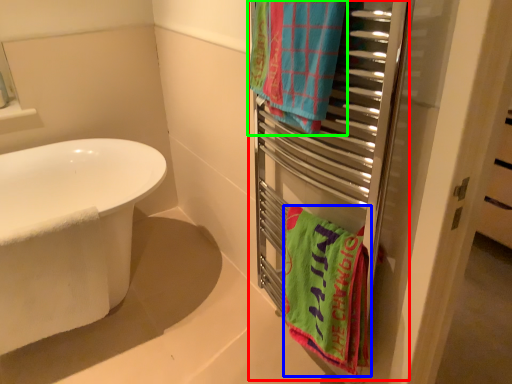
Question: Which is nearer to the closet (highlighted by a red box)? towel/napkin (highlighted by a blue box) or towel/napkin (highlighted by a green box).

Choices:
 (A) towel/napkin
 (B) towel/napkin

Answer: (A)